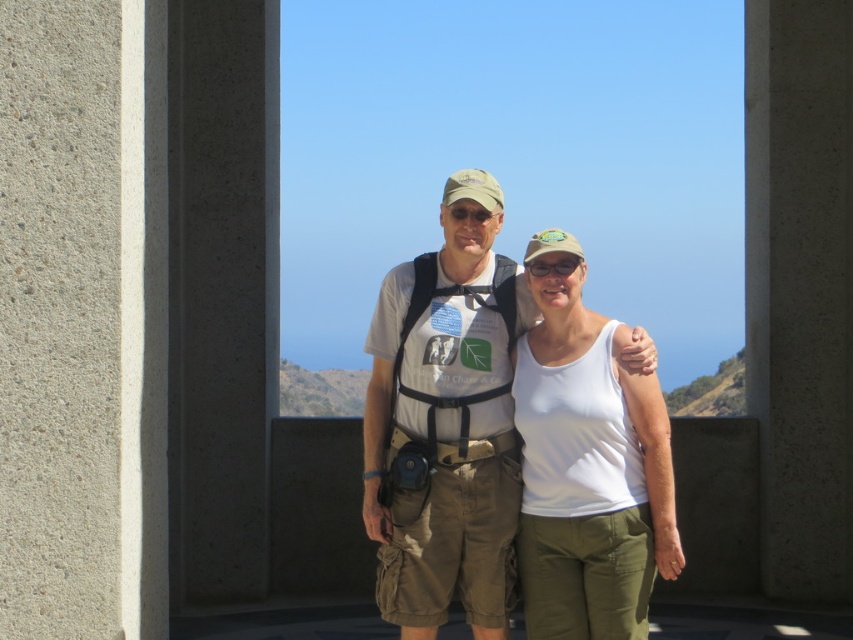
Does gray concrete pillar at center have a lesser width compared to matte white t-shirt at center?

Yes, gray concrete pillar at center is thinner than matte white t-shirt at center.

Does gray concrete pillar at center have a greater width compared to matte white t-shirt at center?

No, gray concrete pillar at center is not wider than matte white t-shirt at center.

What do you see at coordinates (799, 289) in the screenshot? I see `gray concrete pillar at center` at bounding box center [799, 289].

Locate an element on the screen. The height and width of the screenshot is (640, 853). gray concrete pillar at center is located at coordinates (799, 289).

Which is behind, point (838, 241) or point (570, 278)?

Point (838, 241)

Is point (804, 225) farther from camera compared to point (532, 483)?

Yes, point (804, 225) is behind point (532, 483).

Where is `gray concrete pillar at center`? gray concrete pillar at center is located at coordinates tap(799, 289).

Based on the photo, is matte white t-shirt at center thinner than white cotton tank top at center?

No, matte white t-shirt at center is not thinner than white cotton tank top at center.

Is matte white t-shirt at center below white cotton tank top at center?

Incorrect, matte white t-shirt at center is not positioned below white cotton tank top at center.

Is point (460, 182) farther from viewer compared to point (650, 548)?

Yes.

Identify the location of matte white t-shirt at center. (445, 422).